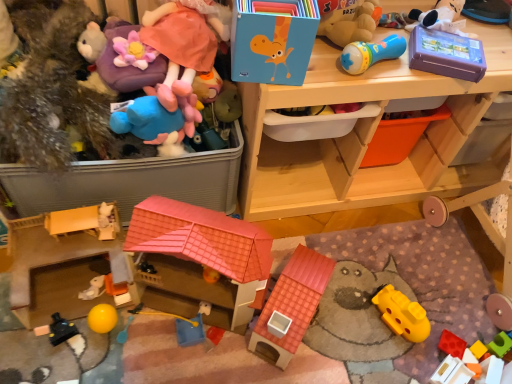
The height and width of the screenshot is (384, 512). Find the location of `free space to the left of rubberized red block at lower right, which appears as the 2th toy when viewed from the right`. free space to the left of rubberized red block at lower right, which appears as the 2th toy when viewed from the right is located at coordinates (386, 340).